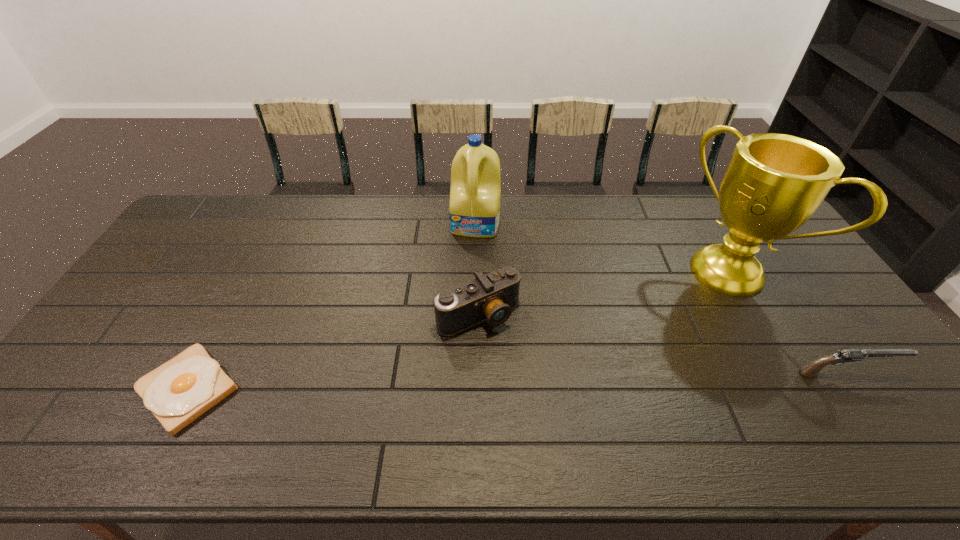
This screenshot has height=540, width=960. Find the location of `vacant spot on the desktop that is between the leftmost object and the fourth tallest object and is positioned on the lens of the third shortest object`. vacant spot on the desktop that is between the leftmost object and the fourth tallest object and is positioned on the lens of the third shortest object is located at coordinates (528, 381).

At what (x,y) coordinates should I click in order to perform the action: click on vacant space on the desktop that is between the leftmost object and the gun and is positioned on the label of the second tallest object. Please return your answer as a coordinate pair (x, y). Looking at the image, I should click on (444, 383).

This screenshot has height=540, width=960. I want to click on free space on the desktop that is between the shortest object and the gun and is positioned on the shiny surface of the award, so click(606, 379).